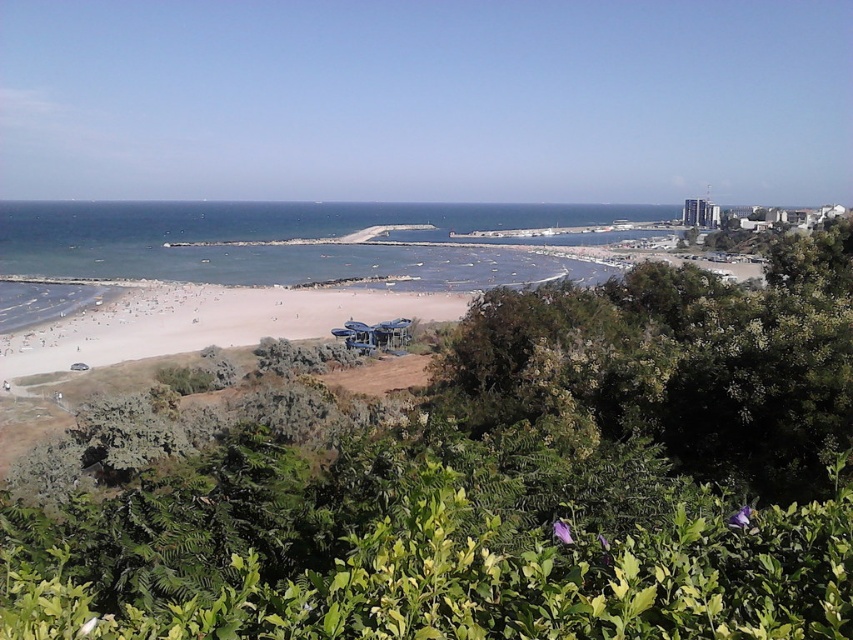
Question: Is green leafy bush at center above light beige sand at center?

Choices:
 (A) yes
 (B) no

Answer: (B)

Question: Which point is farther from the camera taking this photo?

Choices:
 (A) (99, 260)
 (B) (38, 355)
 (C) (672, 413)

Answer: (A)

Question: Does blue water at center lie behind light beige sand at center?

Choices:
 (A) no
 (B) yes

Answer: (B)

Question: Which object is positioned farthest from the blue water at center?

Choices:
 (A) light beige sand at center
 (B) green leafy bush at center

Answer: (B)

Question: Can you confirm if green leafy bush at center is positioned above light beige sand at center?

Choices:
 (A) yes
 (B) no

Answer: (B)

Question: Which is nearer to the green leafy bush at center?

Choices:
 (A) blue water at center
 (B) light beige sand at center

Answer: (B)